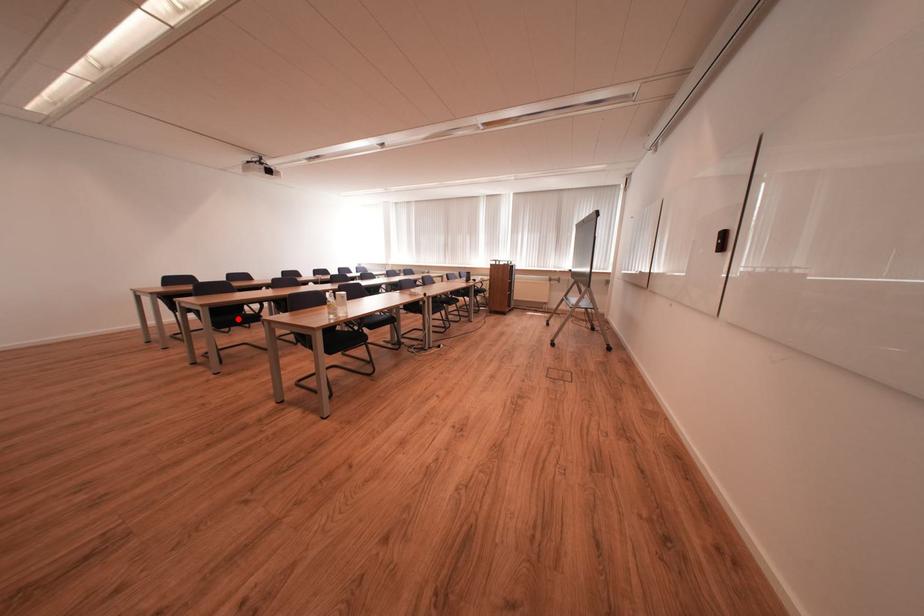
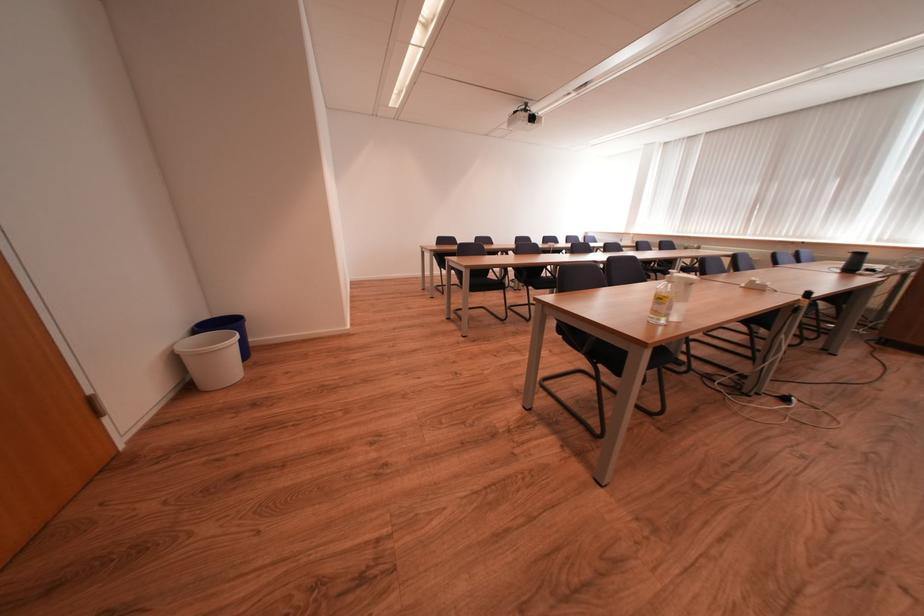
Question: A red point is marked in image1. In image2, is the corresponding 3D point closer to the camera or farther? Reply with the corresponding letter.

Choices:
 (A) The corresponding 3D point is closer.
 (B) The corresponding 3D point is farther.

Answer: (B)